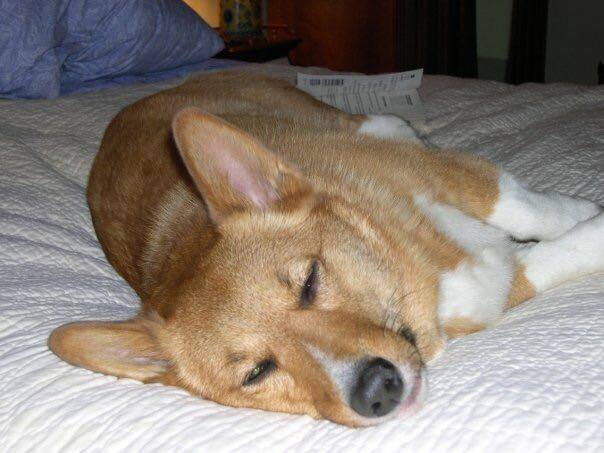
The image size is (604, 453). What are the coordinates of `book` in the screenshot? It's located at (379, 82).